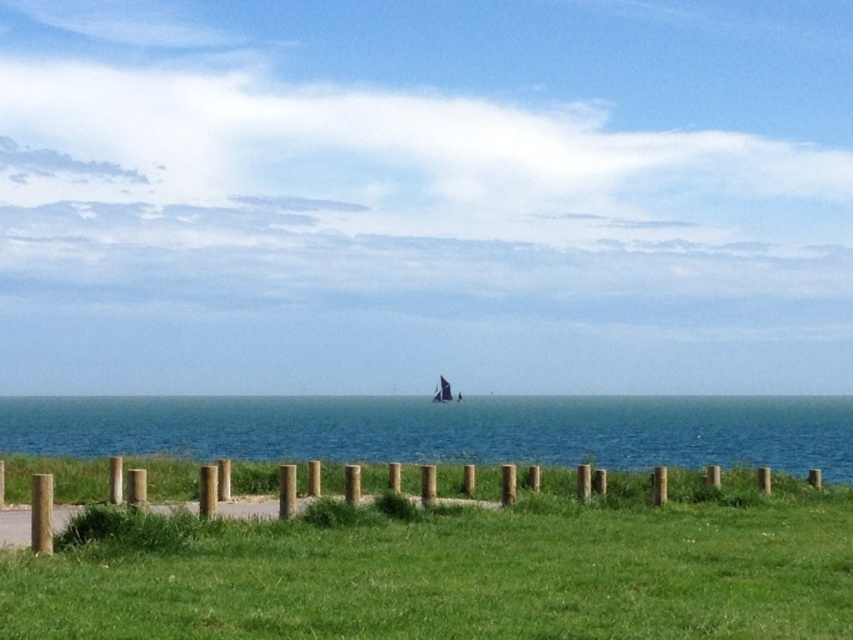
Does point (781, 544) come behind point (491, 461)?

No, it is not.

Can you confirm if green grass at center is positioned to the left of blue water at center?

Yes, green grass at center is to the left of blue water at center.

At what (x,y) coordinates should I click in order to perform the action: click on green grass at center. Please return your answer as a coordinate pair (x, y). The height and width of the screenshot is (640, 853). Looking at the image, I should click on (460, 577).

Which is more to the right, green grass at center or wooden posts at center?

Positioned to the right is green grass at center.

Which is in front, point (599, 573) or point (525, 508)?

Point (599, 573)

Locate an element on the screen. Image resolution: width=853 pixels, height=640 pixels. green grass at center is located at coordinates (460, 577).

Between point (770, 464) and point (848, 492), which one is positioned behind?

Point (770, 464)

Does blue water at center have a greater width compared to wooden posts at center?

Yes, blue water at center is wider than wooden posts at center.

Is point (450, 442) positioned in front of point (245, 461)?

No, it is not.

Locate an element on the screen. Image resolution: width=853 pixels, height=640 pixels. blue water at center is located at coordinates (445, 429).